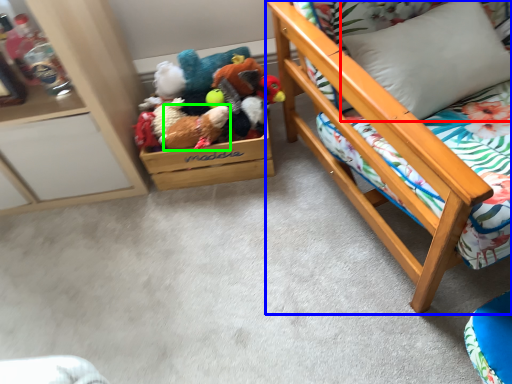
Question: Which is farther away from pillow (highlighted by a red box)? furniture (highlighted by a blue box) or toy (highlighted by a green box)?

Choices:
 (A) furniture
 (B) toy

Answer: (B)